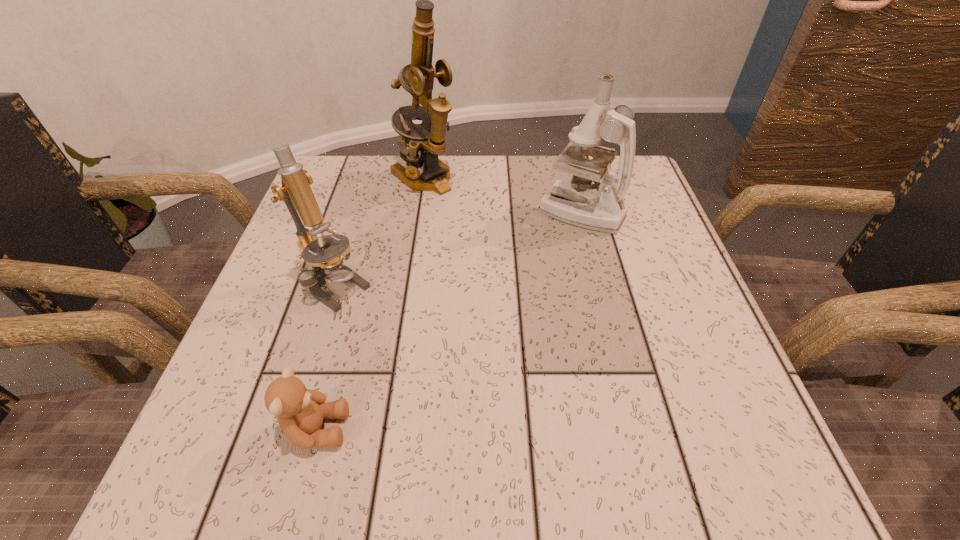
In the image, there is a desktop. At what (x,y) coordinates should I click in order to perform the action: click on free space at the near right corner. Please return your answer as a coordinate pair (x, y). The image size is (960, 540). Looking at the image, I should click on (738, 430).

Find the location of a particular element. vacant space that's between the tallest microscope and the nearest object is located at coordinates (371, 303).

Image resolution: width=960 pixels, height=540 pixels. What are the coordinates of `vacant area that lies between the rightmost microscope and the tallest object` in the screenshot? It's located at (502, 194).

Where is `vacant space that's between the rightmost object and the third farthest object`? vacant space that's between the rightmost object and the third farthest object is located at coordinates (459, 250).

Identify the location of free spot between the rightmost microscope and the second nearest object. (459, 250).

Where is `empty location between the nearest microscope and the teddy bear`? Image resolution: width=960 pixels, height=540 pixels. empty location between the nearest microscope and the teddy bear is located at coordinates (326, 359).

Image resolution: width=960 pixels, height=540 pixels. I want to click on vacant region between the tallest microscope and the rightmost object, so click(x=502, y=194).

Where is `free point between the teddy bear and the nearest microscope`? The image size is (960, 540). free point between the teddy bear and the nearest microscope is located at coordinates (326, 359).

Image resolution: width=960 pixels, height=540 pixels. I want to click on vacant area that lies between the rightmost microscope and the nearest microscope, so click(x=459, y=250).

Find the location of a particular element. vacant area that lies between the tallest object and the teddy bear is located at coordinates (371, 303).